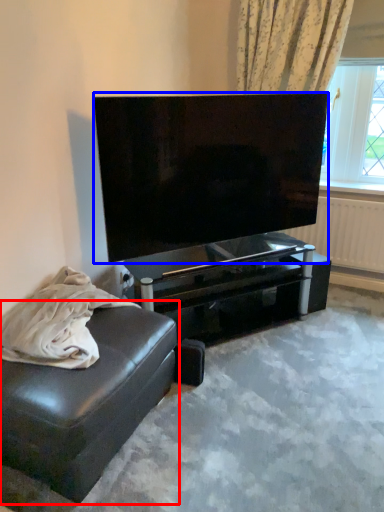
Question: Which object is closer to the camera taking this photo, studio couch (highlighted by a red box) or television (highlighted by a blue box)?

Choices:
 (A) studio couch
 (B) television

Answer: (A)